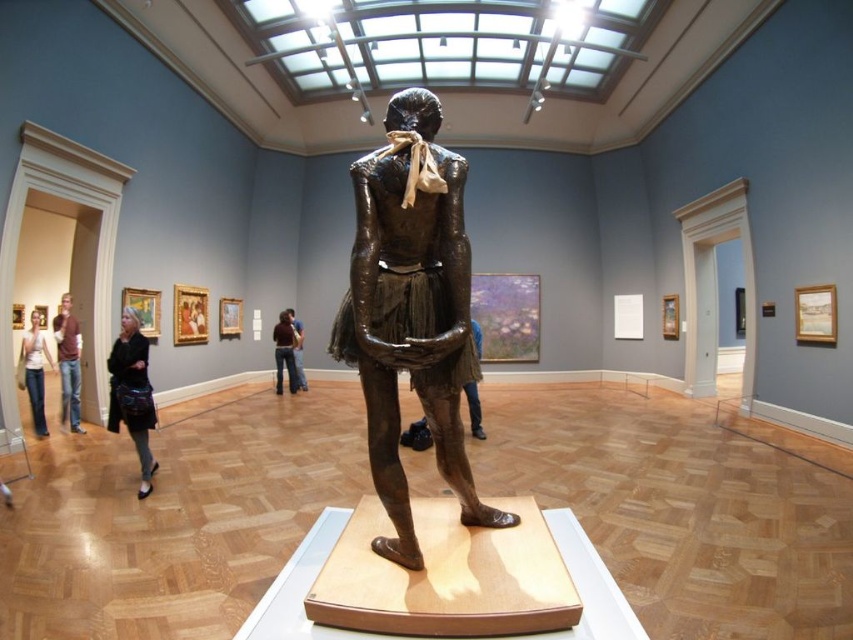
Is dark brown leather jacket at lower left taller than denim jeans at left?

Correct, dark brown leather jacket at lower left is much taller as denim jeans at left.

Can you confirm if dark brown leather jacket at lower left is bigger than denim jeans at left?

Indeed, dark brown leather jacket at lower left has a larger size compared to denim jeans at left.

Is point (138, 488) in front of point (38, 403)?

Yes.

Image resolution: width=853 pixels, height=640 pixels. In order to click on dark brown leather jacket at lower left in this screenshot , I will do `click(132, 394)`.

Does brown leather jacket at left come behind denim jeans at left?

Yes, brown leather jacket at left is behind denim jeans at left.

Can you confirm if brown leather jacket at left is positioned below denim jeans at left?

No.

This screenshot has width=853, height=640. Identify the location of brown leather jacket at left. (68, 364).

Which of these two, dark brown leather jacket at lower left or brown leather jacket at left, stands shorter?

dark brown leather jacket at lower left is shorter.

Between dark brown leather jacket at lower left and brown leather jacket at left, which one has more height?

Standing taller between the two is brown leather jacket at left.

Is point (154, 413) farther from camera compared to point (62, 298)?

No, (154, 413) is closer to viewer.

Where is `dark brown leather jacket at lower left`? The height and width of the screenshot is (640, 853). dark brown leather jacket at lower left is located at coordinates (132, 394).